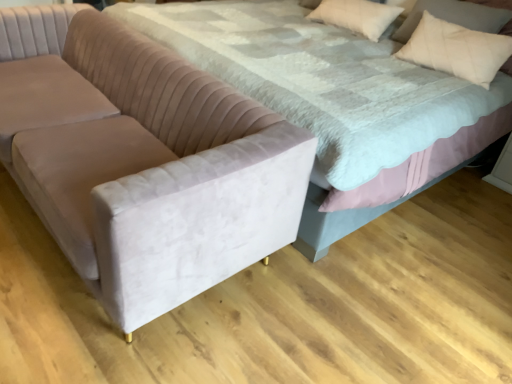
Question: Does beige cotton pillow at upper right have a larger size compared to velvet couch at left?

Choices:
 (A) no
 (B) yes

Answer: (A)

Question: Is the depth of beige cotton pillow at upper right less than that of velvet couch at left?

Choices:
 (A) no
 (B) yes

Answer: (A)

Question: From a real-world perspective, does beige cotton pillow at upper right stand above velvet couch at left?

Choices:
 (A) yes
 (B) no

Answer: (A)

Question: From the image's perspective, is beige cotton pillow at upper right above velvet couch at left?

Choices:
 (A) yes
 (B) no

Answer: (A)

Question: Is beige cotton pillow at upper right not near velvet couch at left?

Choices:
 (A) no
 (B) yes

Answer: (B)

Question: Would you say velvet bed at center is inside or outside white soft pillow at upper right?

Choices:
 (A) outside
 (B) inside

Answer: (A)

Question: From a real-world perspective, is velvet bed at center physically located above or below white soft pillow at upper right?

Choices:
 (A) below
 (B) above

Answer: (A)

Question: In the image, is velvet bed at center positioned in front of or behind white soft pillow at upper right?

Choices:
 (A) front
 (B) behind

Answer: (A)

Question: Is point (316, 198) closer or farther from the camera than point (312, 18)?

Choices:
 (A) closer
 (B) farther

Answer: (A)

Question: Based on their positions, is velvet couch at left located to the left or right of velvet bed at center?

Choices:
 (A) left
 (B) right

Answer: (A)

Question: Based on their sizes in the image, would you say velvet couch at left is bigger or smaller than velvet bed at center?

Choices:
 (A) small
 (B) big

Answer: (A)

Question: From the image's perspective, is velvet couch at left above or below velvet bed at center?

Choices:
 (A) below
 (B) above

Answer: (A)

Question: Is velvet couch at left taller or shorter than velvet bed at center?

Choices:
 (A) short
 (B) tall

Answer: (A)

Question: Looking at the image, does velvet couch at left seem bigger or smaller compared to white soft pillow at upper right?

Choices:
 (A) small
 (B) big

Answer: (B)

Question: Considering the positions of velvet couch at left and white soft pillow at upper right in the image, is velvet couch at left wider or thinner than white soft pillow at upper right?

Choices:
 (A) wide
 (B) thin

Answer: (A)